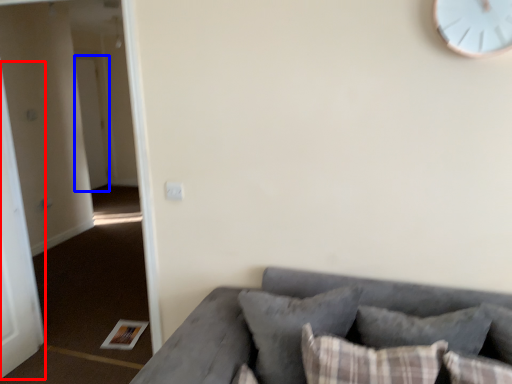
Question: Which point is closer to the camera, door (highlighted by a red box) or door (highlighted by a blue box)?

Choices:
 (A) door
 (B) door

Answer: (A)